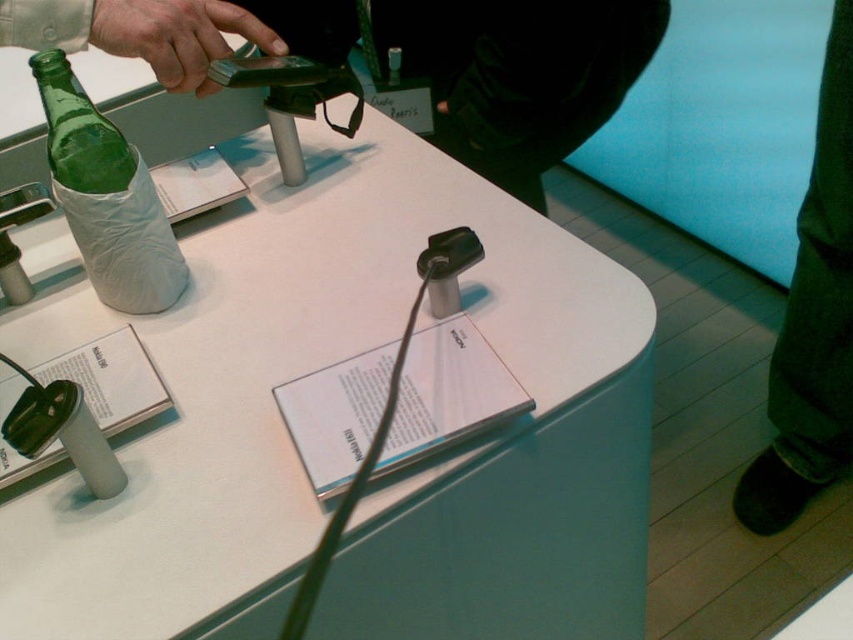
Looking at this image, how much distance is there between green glass bottle at left and green matte phone at upper left?

They are 5.25 inches apart.

Is green glass bottle at left below green matte phone at upper left?

Yes, green glass bottle at left is below green matte phone at upper left.

This screenshot has width=853, height=640. What do you see at coordinates (106, 196) in the screenshot?
I see `green glass bottle at left` at bounding box center [106, 196].

Find the location of a particular element. green glass bottle at left is located at coordinates (106, 196).

Is dark green pants at lower right thinner than green matte phone at upper left?

Incorrect, dark green pants at lower right's width is not less than green matte phone at upper left's.

Looking at this image, between dark green pants at lower right and green matte phone at upper left, which one is positioned higher?

green matte phone at upper left

Where is `dark green pants at lower right`? The width and height of the screenshot is (853, 640). dark green pants at lower right is located at coordinates (811, 321).

Find the location of a particular element. This screenshot has width=853, height=640. white paper at center is located at coordinates (296, 454).

Between white paper at center and green matte phone at upper left, which one has more height?

white paper at center is taller.

Locate an element on the screen. The image size is (853, 640). white paper at center is located at coordinates (296, 454).

Identify the location of white paper at center. The height and width of the screenshot is (640, 853). (296, 454).